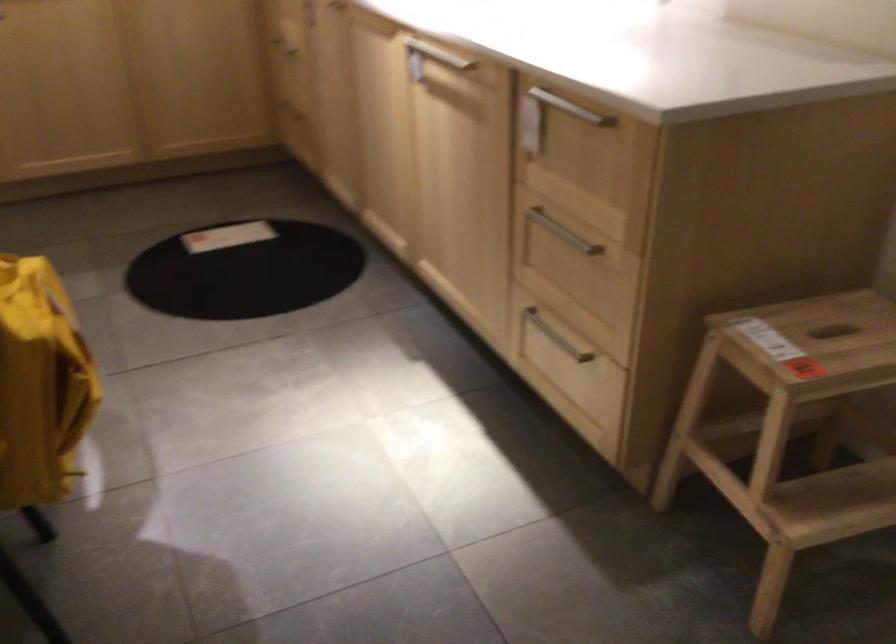
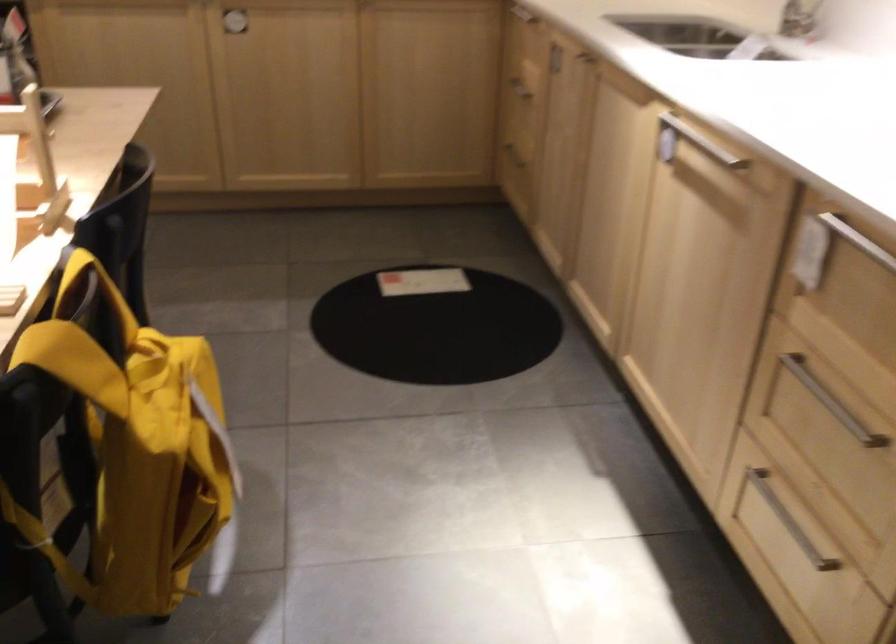
Question: What movement of the cameraman would produce the second image?

Choices:
 (A) Left
 (B) Right
 (C) Forward
 (D) Backward

Answer: (C)